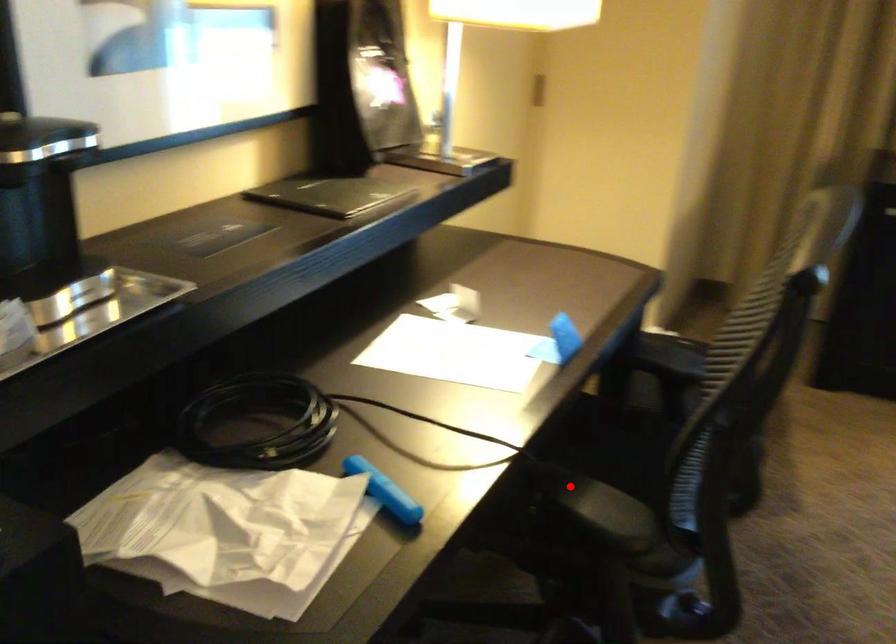
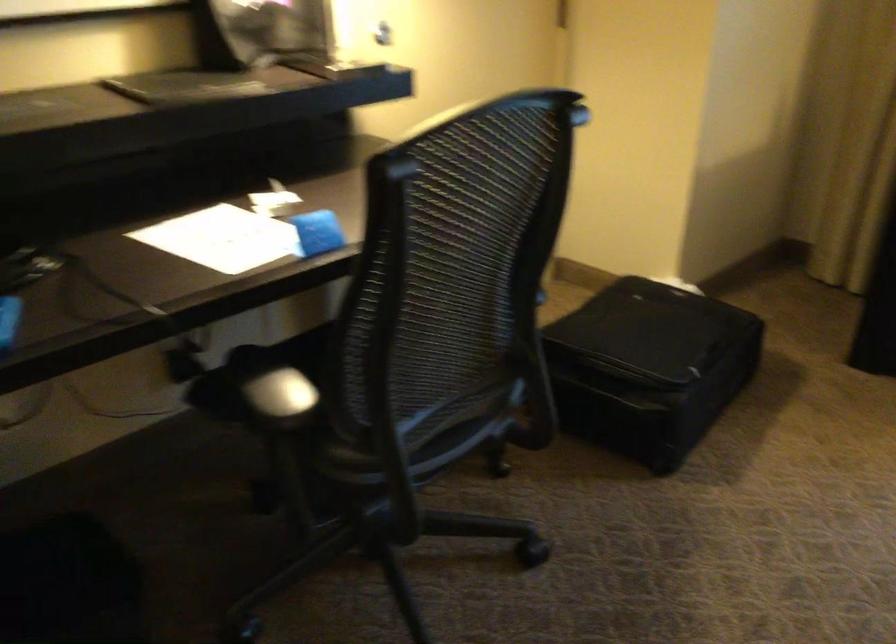
The point at the highlighted location is marked in the first image. Where is the corresponding point in the second image?

(259, 371)